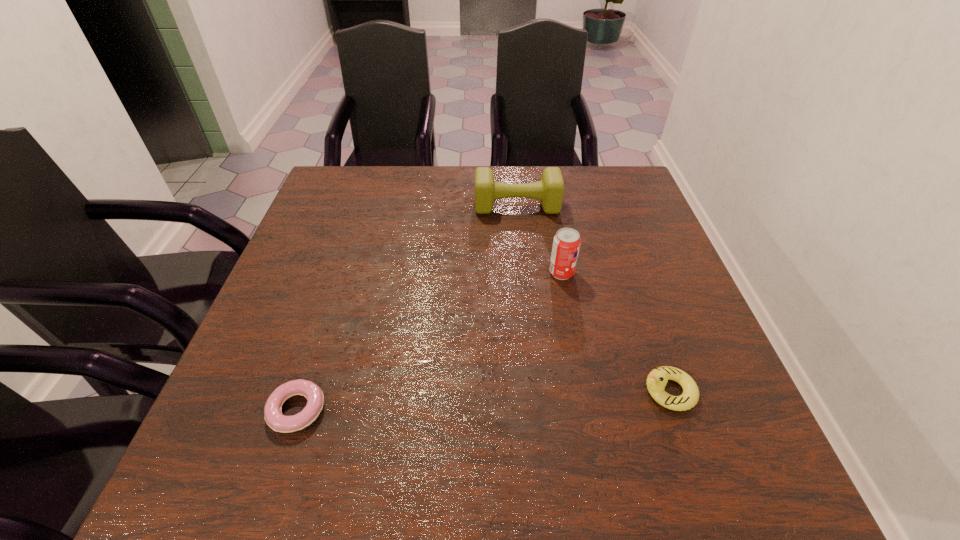
This screenshot has height=540, width=960. What are the coordinates of `free area in between the dumbbell and the soda can` in the screenshot? It's located at (540, 239).

Locate an element on the screen. The image size is (960, 540). free space between the rightmost object and the dumbbell is located at coordinates (593, 299).

Image resolution: width=960 pixels, height=540 pixels. I want to click on empty space that is in between the leftmost object and the farthest object, so click(407, 308).

Where is `object that is the second closest one to the soda can`? The width and height of the screenshot is (960, 540). object that is the second closest one to the soda can is located at coordinates (657, 379).

Locate an element on the screen. object that is the third nearest to the third tallest object is located at coordinates (273, 416).